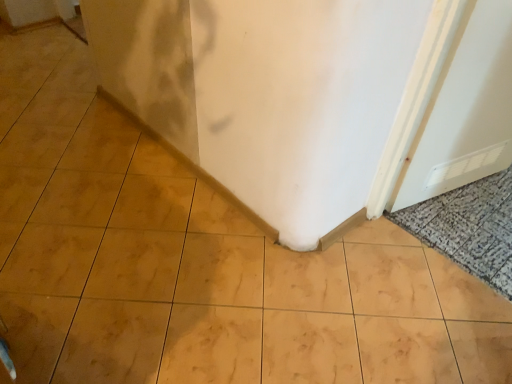
The width and height of the screenshot is (512, 384). What do you see at coordinates (464, 110) in the screenshot? I see `white matte door at right` at bounding box center [464, 110].

Locate an element on the screen. Image resolution: width=512 pixels, height=384 pixels. white matte door at right is located at coordinates 464,110.

Identify the location of white matte door at right. (464, 110).